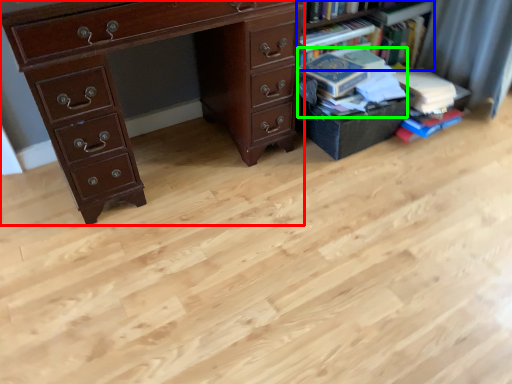
Question: Which object is positioned farthest from chest of drawers (highlighted by a red box)? Select from bookcase (highlighted by a blue box) and book (highlighted by a green box).

Choices:
 (A) bookcase
 (B) book

Answer: (A)